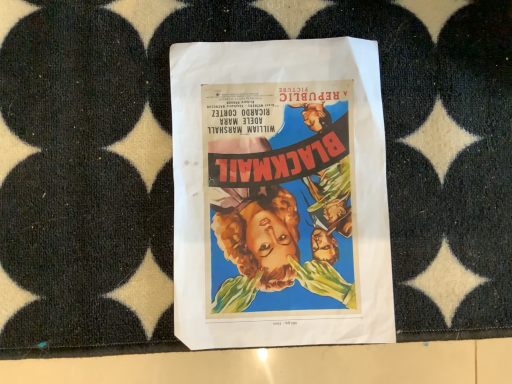
This screenshot has height=384, width=512. What do you see at coordinates (280, 194) in the screenshot? I see `vibrant paper poster at center` at bounding box center [280, 194].

This screenshot has height=384, width=512. Find the location of `vibrant paper poster at center`. vibrant paper poster at center is located at coordinates (280, 194).

Where is `vibrant paper poster at center`? vibrant paper poster at center is located at coordinates (280, 194).